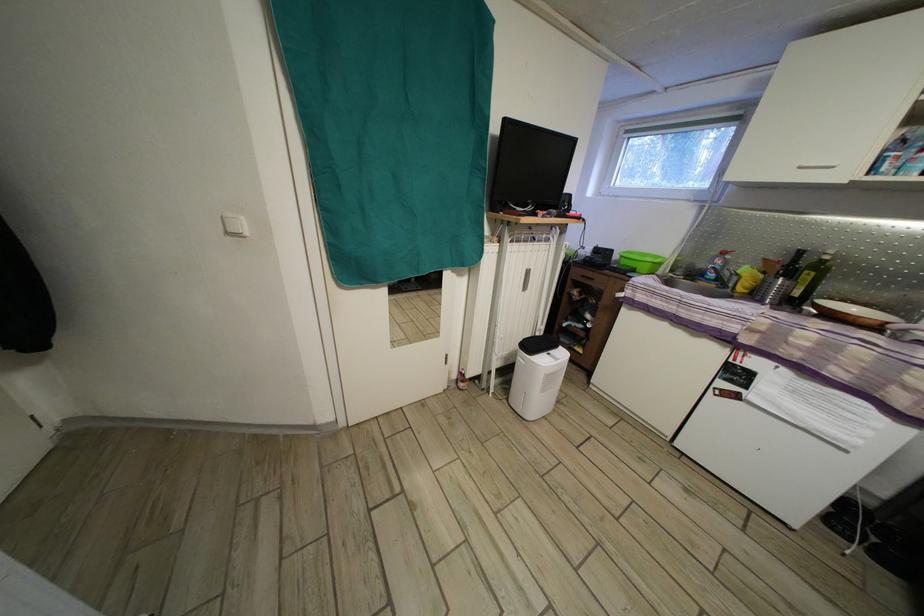
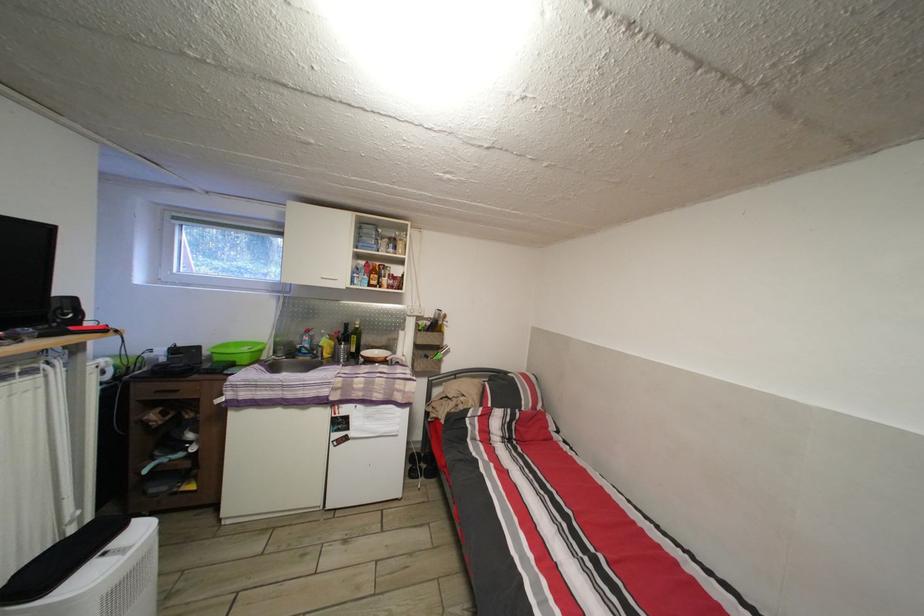
Where in the second image is the point corresponding to (622,262) from the first image?

(213, 359)